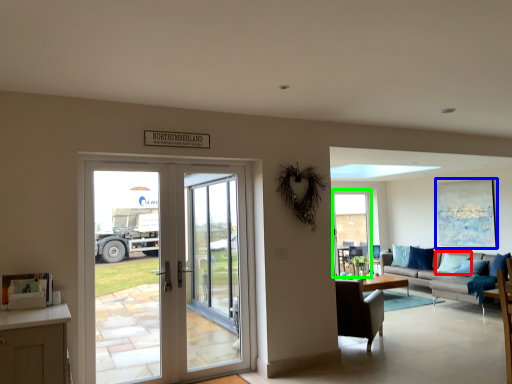
Question: Which object is positioned farthest from pillow (highlighted by a red box)? Select from picture frame (highlighted by a blue box) and window screen (highlighted by a green box).

Choices:
 (A) picture frame
 (B) window screen

Answer: (B)